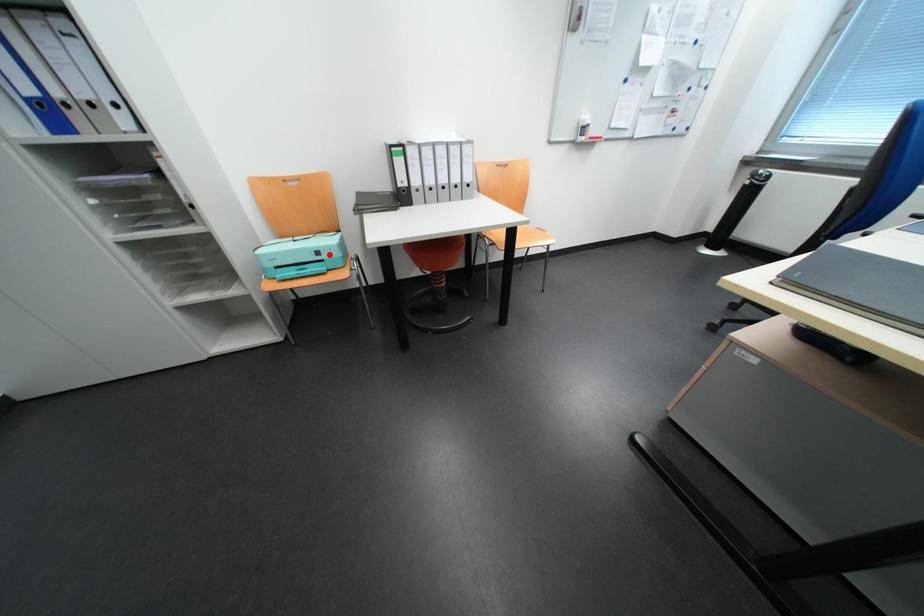
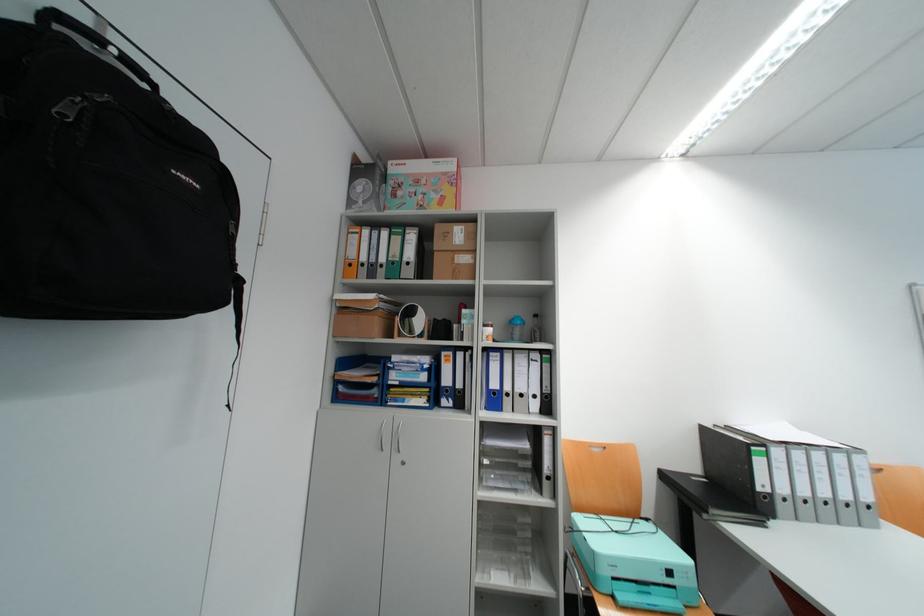
The point at the highlighted location is marked in the first image. Where is the corresponding point in the second image?

(682, 573)